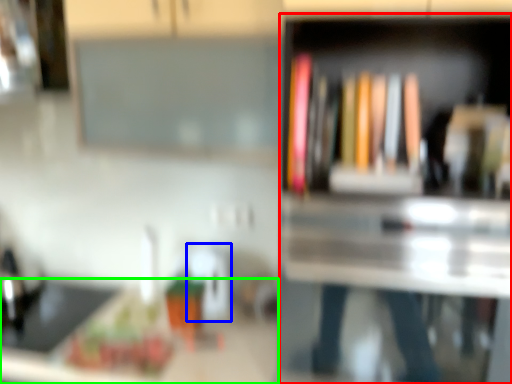
Question: Which object is the farthest from bookshelf (highlighted by a red box)? Choose among these: appliance (highlighted by a blue box) or counter top (highlighted by a green box).

Choices:
 (A) appliance
 (B) counter top

Answer: (A)